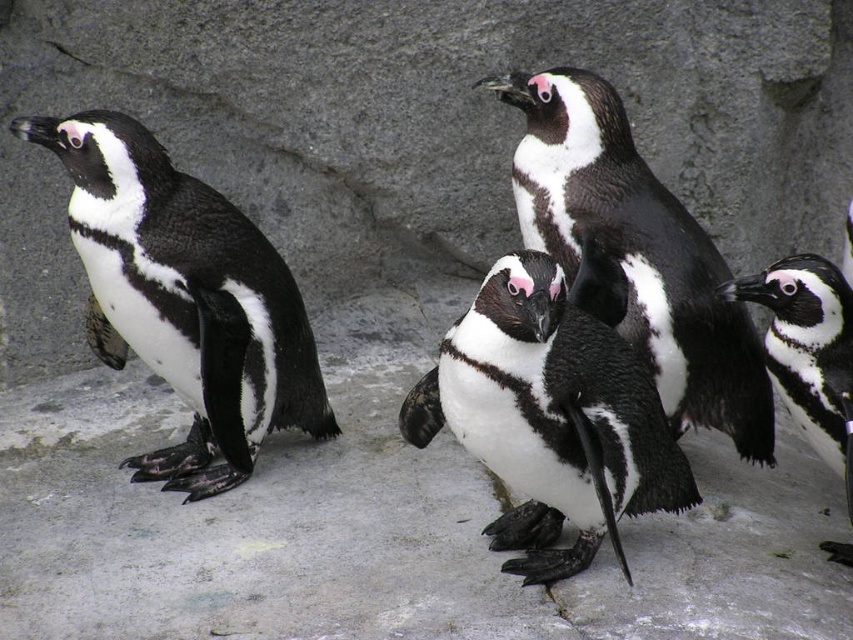
Does white matte penguin at center have a lesser width compared to black and white feathers at center?

Yes, white matte penguin at center is thinner than black and white feathers at center.

This screenshot has width=853, height=640. I want to click on white matte penguin at center, so click(550, 419).

I want to click on black glossy penguin at left, so click(184, 300).

Between black glossy penguin at left and black matte penguin at right, which one is positioned lower?

Positioned lower is black matte penguin at right.

What do you see at coordinates (184, 300) in the screenshot? This screenshot has height=640, width=853. I see `black glossy penguin at left` at bounding box center [184, 300].

What are the coordinates of `black glossy penguin at left` in the screenshot? It's located at (184, 300).

Is black glossy penguin at left shorter than black and white feathers at center?

Yes.

Is black glossy penguin at left closer to the viewer compared to black and white feathers at center?

That is True.

Based on the photo, who is more distant from viewer, (x=141, y=221) or (x=759, y=356)?

Positioned behind is point (x=759, y=356).

Identify the location of black glossy penguin at left. (x=184, y=300).